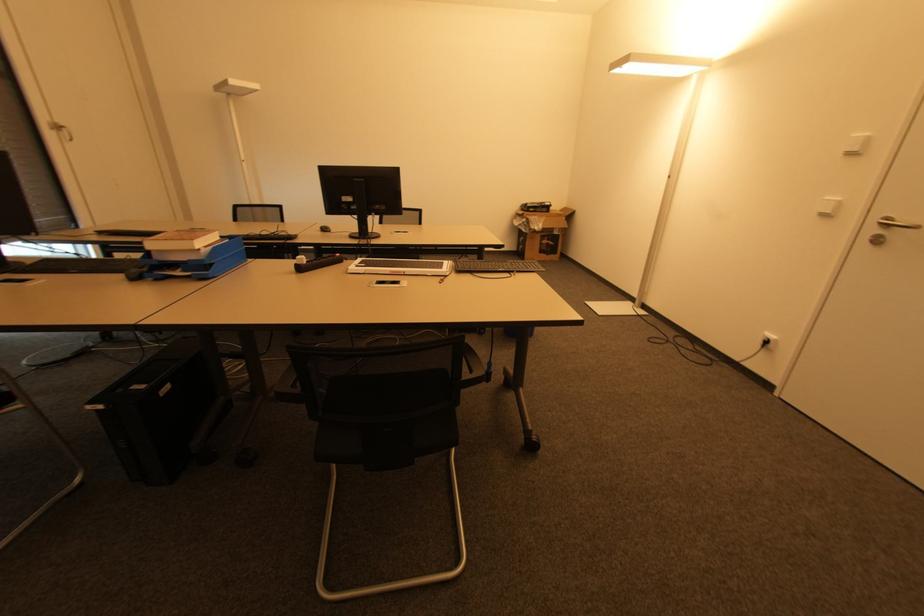
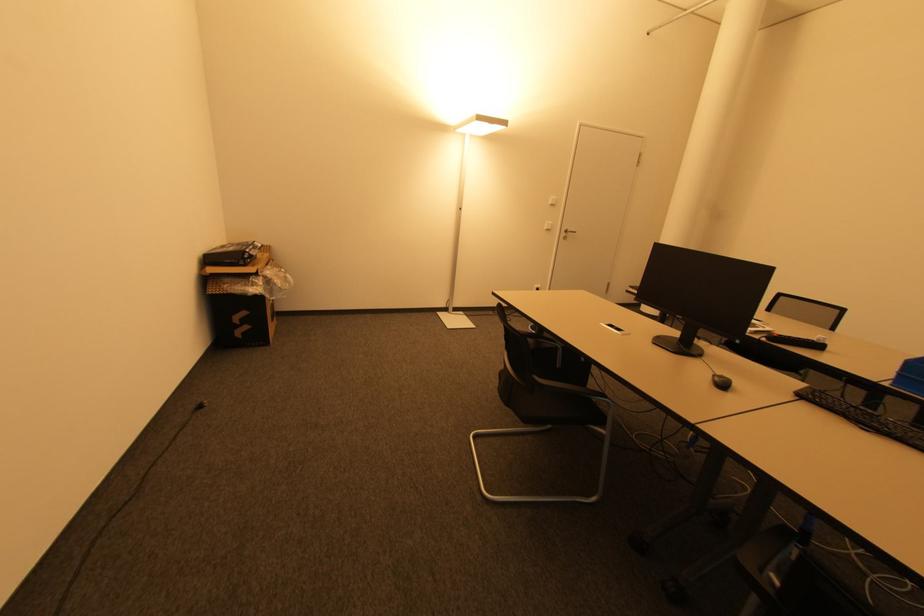
Question: I am providing you with two images of the same scene from different viewpoints. Which of the following objects are not visible in image2?

Choices:
 (A) black power cord
 (B) black computer mouse
 (C) black smartphone
 (D) none of these

Answer: (D)